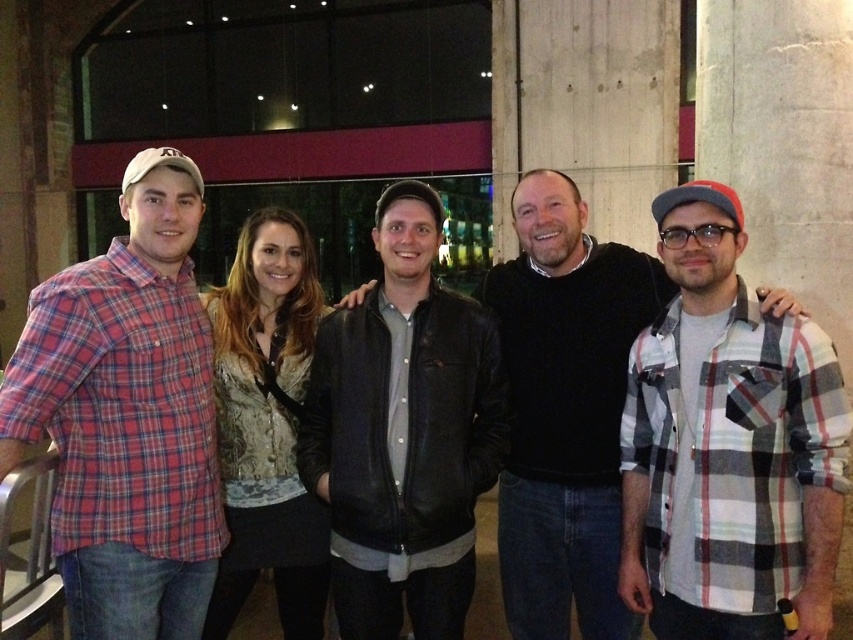
Question: Considering the relative positions of black leather jacket at center and leather jacket at center in the image provided, where is black leather jacket at center located with respect to leather jacket at center?

Choices:
 (A) above
 (B) below

Answer: (A)

Question: Does plaid cotton shirt at left appear on the right side of leather jacket at center?

Choices:
 (A) yes
 (B) no

Answer: (B)

Question: Which point is closer to the camera?

Choices:
 (A) plaid flannel shirt at center
 (B) plaid cotton shirt at left

Answer: (A)

Question: Estimate the real-world distances between objects in this image. Which object is farther from the plaid cotton shirt at left?

Choices:
 (A) black leather jacket at center
 (B) plaid flannel shirt at center
 (C) leather jacket at center

Answer: (B)

Question: Is plaid flannel shirt at center smaller than plaid cotton shirt at left?

Choices:
 (A) no
 (B) yes

Answer: (B)

Question: Estimate the real-world distances between objects in this image. Which object is farther from the black leather jacket at center?

Choices:
 (A) leather jacket at center
 (B) plaid cotton shirt at left

Answer: (B)